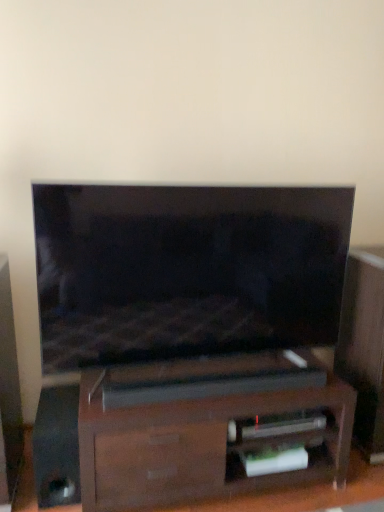
Question: Considering the positions of black glossy speaker at lower left and dark wood soundbar at center in the image, is black glossy speaker at lower left bigger or smaller than dark wood soundbar at center?

Choices:
 (A) big
 (B) small

Answer: (B)

Question: Is black glossy speaker at lower left inside the boundaries of dark wood soundbar at center, or outside?

Choices:
 (A) outside
 (B) inside

Answer: (A)

Question: Estimate the real-world distances between objects in this image. Which object is farther from the matte black tv at center?

Choices:
 (A) dark wood soundbar at center
 (B) black glossy speaker at lower left

Answer: (B)

Question: Which is nearer to the dark wood soundbar at center?

Choices:
 (A) matte black tv at center
 (B) black glossy speaker at lower left

Answer: (A)